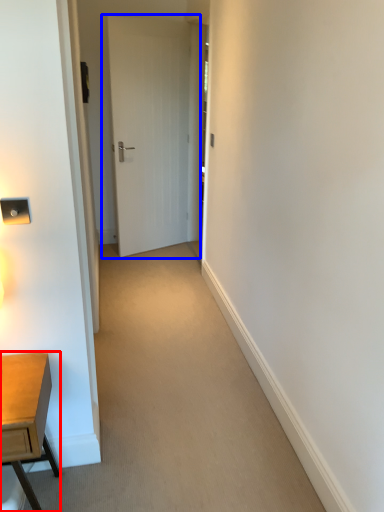
Question: Which point is closer to the camera, desk (highlighted by a red box) or door (highlighted by a blue box)?

Choices:
 (A) desk
 (B) door

Answer: (A)